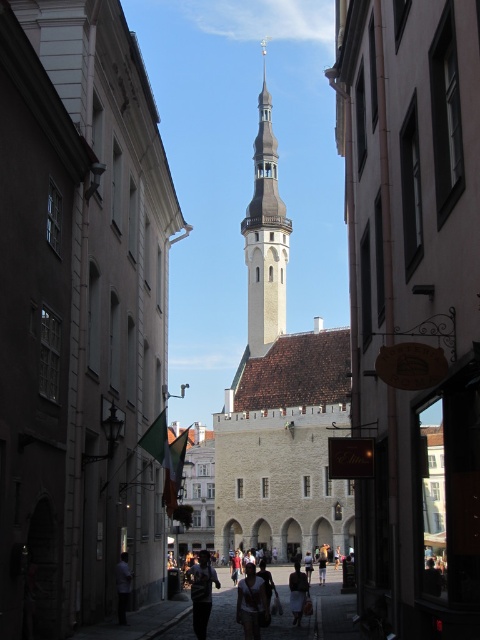
Question: Is light beige fabric dress at center further to the viewer compared to light brown fabric skirt at center?

Choices:
 (A) no
 (B) yes

Answer: (A)

Question: Which point appears closest to the camera in this image?

Choices:
 (A) (264, 598)
 (B) (120, 588)
 (C) (206, 573)
 (D) (249, 355)

Answer: (A)

Question: Does white stone bell tower at center have a greater width compared to light beige fabric dress at center?

Choices:
 (A) no
 (B) yes

Answer: (A)

Question: Which object is closer to the camera taking this photo?

Choices:
 (A) light brown fabric skirt at center
 (B) light beige fabric dress at center
 (C) matte black jacket at center

Answer: (C)

Question: Can you confirm if light brown leather jacket at center is thinner than light brown fabric skirt at center?

Choices:
 (A) yes
 (B) no

Answer: (A)

Question: Among these objects, which one is farthest from the camera?

Choices:
 (A) white stone bell tower at center
 (B) light brown fabric skirt at center
 (C) light beige fabric dress at center

Answer: (A)